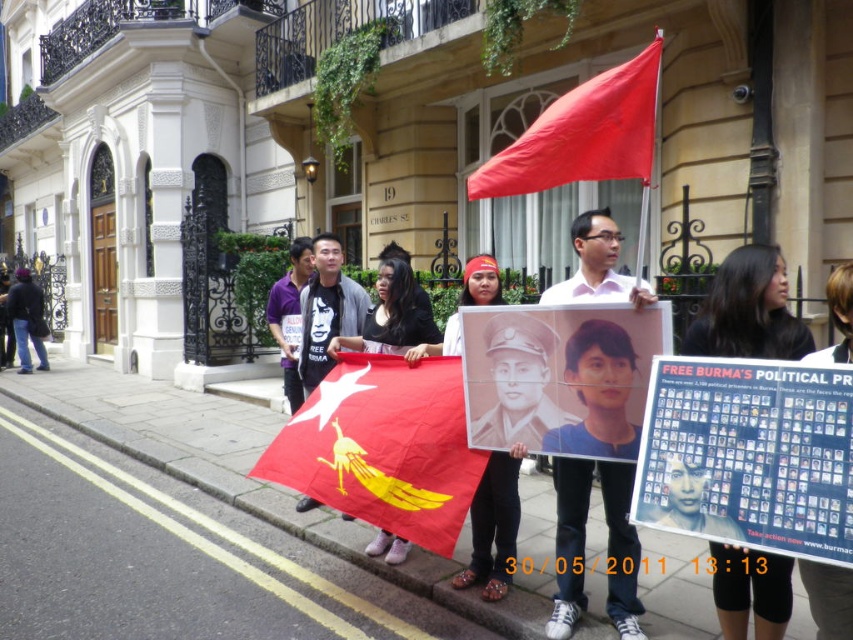
Question: Is blue paper poster at center further to the viewer compared to matte white shirt at center?

Choices:
 (A) yes
 (B) no

Answer: (B)

Question: In this image, where is blue paper poster at center located relative to solid red flag at upper center?

Choices:
 (A) left
 (B) right

Answer: (B)

Question: Estimate the real-world distances between objects in this image. Which object is closer to the dark blue jeans at left?

Choices:
 (A) matte white shirt at center
 (B) solid red flag at upper center
 (C) red fabric flag at center

Answer: (C)

Question: Does blue paper poster at center appear on the right side of solid red flag at upper center?

Choices:
 (A) no
 (B) yes

Answer: (B)

Question: Which point is farther to the camera?

Choices:
 (A) (575, 88)
 (B) (39, 364)

Answer: (B)

Question: Which point is farther to the camera?

Choices:
 (A) (608, 113)
 (B) (722, 308)
 (C) (674, 381)

Answer: (B)